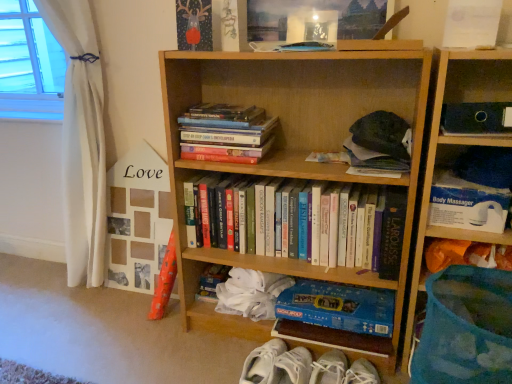
At what (x,y) coordinates should I click in order to perform the action: click on free location in front of white fabric curtain at left. Please return your answer as a coordinate pair (x, y). Looking at the image, I should click on (44, 325).